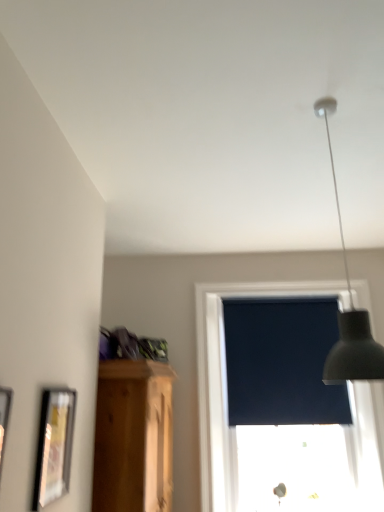
Question: Is wooden picture frame at left, the first picture frame when ordered from front to back, thinner than matte black picture frame at lower left, the 2th picture frame from the front?

Choices:
 (A) yes
 (B) no

Answer: (A)

Question: From a real-world perspective, is wooden picture frame at left, the first picture frame when ordered from front to back, on top of matte black picture frame at lower left, the 2th picture frame from the front?

Choices:
 (A) no
 (B) yes

Answer: (B)

Question: Could matte black picture frame at lower left, the 2th picture frame from the front, be considered to be inside wooden picture frame at left, the 2th picture frame in the back-to-front sequence?

Choices:
 (A) no
 (B) yes

Answer: (A)

Question: Does wooden picture frame at left, the first picture frame when ordered from front to back, have a lesser height compared to matte black picture frame at lower left, the 2th picture frame from the front?

Choices:
 (A) yes
 (B) no

Answer: (A)

Question: Is wooden picture frame at left, the first picture frame when ordered from front to back, beside matte black picture frame at lower left, the 1th picture frame viewed from the back?

Choices:
 (A) yes
 (B) no

Answer: (B)

Question: Can you confirm if wooden picture frame at left, the 2th picture frame in the back-to-front sequence, is smaller than matte black picture frame at lower left, the 1th picture frame viewed from the back?

Choices:
 (A) yes
 (B) no

Answer: (B)

Question: From the image's perspective, does matte black picture frame at lower left, the 2th picture frame from the front, appear higher than dark matte window screen at center?

Choices:
 (A) no
 (B) yes

Answer: (B)

Question: Is the depth of matte black picture frame at lower left, the 1th picture frame viewed from the back, greater than that of dark matte window screen at center?

Choices:
 (A) yes
 (B) no

Answer: (B)

Question: Is matte black picture frame at lower left, the 1th picture frame viewed from the back, at the left side of dark matte window screen at center?

Choices:
 (A) no
 (B) yes

Answer: (B)

Question: Is matte black picture frame at lower left, the 2th picture frame from the front, looking in the opposite direction of dark matte window screen at center?

Choices:
 (A) no
 (B) yes

Answer: (A)

Question: From the image's perspective, is matte black picture frame at lower left, the 2th picture frame from the front, under dark matte window screen at center?

Choices:
 (A) no
 (B) yes

Answer: (A)

Question: Is matte black picture frame at lower left, the 2th picture frame from the front, at the right side of dark matte window screen at center?

Choices:
 (A) no
 (B) yes

Answer: (A)

Question: Is matte black picture frame at lower left, the 1th picture frame viewed from the back, completely or partially inside dark matte window screen at center?

Choices:
 (A) yes
 (B) no

Answer: (B)